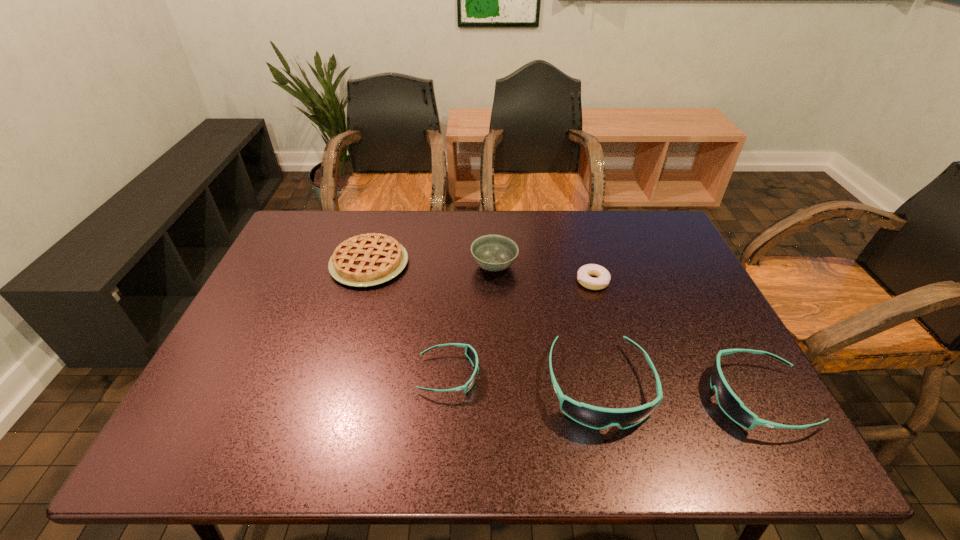
I want to click on free spot at the left edge of the desktop, so click(x=231, y=340).

The height and width of the screenshot is (540, 960). In the image, there is a desktop. In order to click on free space at the far left corner in this screenshot , I will do coord(301,251).

Image resolution: width=960 pixels, height=540 pixels. I want to click on vacant area at the near right corner of the desktop, so click(x=740, y=396).

Identify the location of unoccupied position between the bowl and the shortest sunglasses. (471, 320).

Find the location of `vacant area between the rightmost sunglasses and the leftmost sunglasses`. vacant area between the rightmost sunglasses and the leftmost sunglasses is located at coordinates (603, 386).

This screenshot has width=960, height=540. Identify the location of blank region between the bowl and the second tallest sunglasses. (626, 332).

The image size is (960, 540). I want to click on unoccupied position between the bowl and the pie, so click(x=432, y=265).

Identify the location of vacant point located between the doughnut and the pie. Image resolution: width=960 pixels, height=540 pixels. (481, 272).

In order to click on empty space that is in between the shortest object and the bowl in this screenshot , I will do `click(543, 274)`.

Locate an element on the screen. free point between the leftmost sunglasses and the rightmost object is located at coordinates (603, 386).